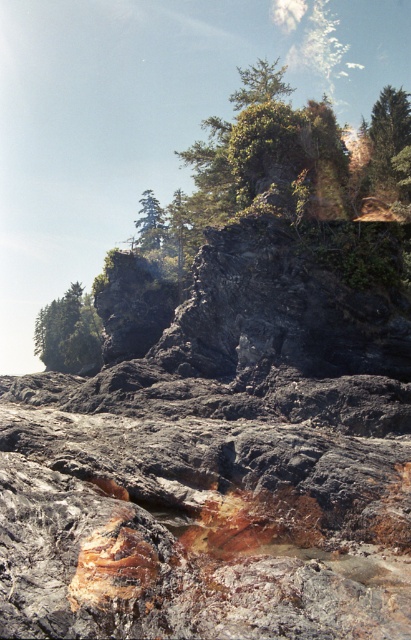
Imagine you are standing at the viewpoint of the image and see two points marked in the scene. The first point is at coordinates point (x=309, y=228) and the second is at point (x=376, y=161). Which point is closer to you?

Point (x=309, y=228) is in front of point (x=376, y=161), so it is closer to you.

You are a hiker trying to navigate through the rocky terrain. You see a green leafy tree at center and a green matte tree at upper center. Which tree would be easier to spot from a distance, and why?

The green leafy tree at center is larger in size than the green matte tree at upper center, making it easier to spot from a distance due to its greater size.

You are a hiker who wants to find the tallest tree in this coastal area. Which tree should you look for between the green matte tree at left and the green matte tree at upper right?

The green matte tree at upper right is taller than the green matte tree at left, so you should look for the green matte tree at upper right.